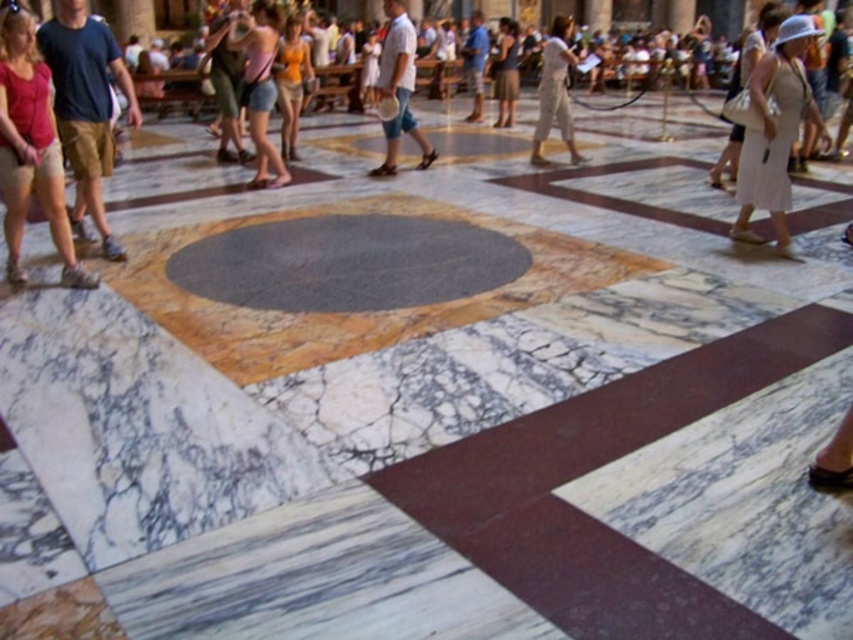
Question: Estimate the real-world distances between objects in this image. Which object is closer to the white cotton dress at right?

Choices:
 (A) matte pink shorts at center
 (B) light beige cotton dress at center
 (C) dark brown leather jacket at center

Answer: (B)

Question: In this image, where is matte pink shorts at center located relative to white cotton shirt at center?

Choices:
 (A) below
 (B) above

Answer: (B)

Question: Which of the following is the farthest from the observer?

Choices:
 (A) (544, 44)
 (B) (291, 109)
 (C) (492, 61)

Answer: (C)

Question: Observing the image, what is the correct spatial positioning of matte pink shorts at center in reference to white cotton shirt at center?

Choices:
 (A) right
 (B) left

Answer: (B)

Question: Estimate the real-world distances between objects in this image. Which object is farther from the light beige cotton dress at center?

Choices:
 (A) orange cotton tank top at center
 (B) matte pink shorts at center
 (C) dark brown leather jacket at center

Answer: (B)

Question: Where is white cotton dress at right located in relation to orange cotton tank top at center in the image?

Choices:
 (A) above
 (B) below

Answer: (B)